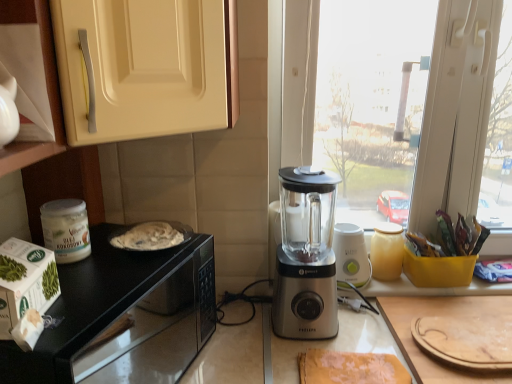
Question: Does satin silver blender at center, acting as the second blender starting from the back, come in front of white cardboard box at left?

Choices:
 (A) no
 (B) yes

Answer: (A)

Question: Does satin silver blender at center, marked as the 1th blender in a left-to-right arrangement, lie behind white cardboard box at left?

Choices:
 (A) no
 (B) yes

Answer: (B)

Question: Does satin silver blender at center, marked as the 1th blender in a left-to-right arrangement, appear on the right side of white cardboard box at left?

Choices:
 (A) no
 (B) yes

Answer: (B)

Question: From a real-world perspective, is satin silver blender at center, marked as the 1th blender in a left-to-right arrangement, positioned over white cardboard box at left based on gravity?

Choices:
 (A) yes
 (B) no

Answer: (B)

Question: Is satin silver blender at center, marked as the 1th blender in a left-to-right arrangement, looking in the opposite direction of white cardboard box at left?

Choices:
 (A) yes
 (B) no

Answer: (B)

Question: Considering the positions of point (403, 367) and point (89, 11), is point (403, 367) closer or farther from the camera than point (89, 11)?

Choices:
 (A) closer
 (B) farther

Answer: (B)

Question: Is yellow fabric at lower center spatially inside matte cream cabinet at upper left, marked as the second cabinetry in a front-to-back arrangement, or outside of it?

Choices:
 (A) outside
 (B) inside

Answer: (A)

Question: From a real-world perspective, relative to matte cream cabinet at upper left, marked as the second cabinetry in a front-to-back arrangement, is yellow fabric at lower center vertically above or below?

Choices:
 (A) above
 (B) below

Answer: (B)

Question: From their relative heights in the image, would you say yellow fabric at lower center is taller or shorter than matte cream cabinet at upper left, marked as the second cabinetry in a front-to-back arrangement?

Choices:
 (A) short
 (B) tall

Answer: (A)

Question: Is yellow fabric at lower center bigger or smaller than satin silver blender at center, which is the 1th blender from front to back?

Choices:
 (A) big
 (B) small

Answer: (B)

Question: In terms of width, does yellow fabric at lower center look wider or thinner when compared to satin silver blender at center, the second blender viewed from the right?

Choices:
 (A) wide
 (B) thin

Answer: (A)

Question: From the image's perspective, is yellow fabric at lower center positioned above or below satin silver blender at center, the second blender viewed from the right?

Choices:
 (A) below
 (B) above

Answer: (A)

Question: Is point (324, 349) positioned closer to the camera than point (321, 296)?

Choices:
 (A) closer
 (B) farther

Answer: (B)

Question: From a real-world perspective, is satin silver blender at center, which is the second blender from left to right, physically located above or below matte cream cabinet at upper left, which is the 1th cabinetry in right-to-left order?

Choices:
 (A) below
 (B) above

Answer: (A)

Question: Considering the relative positions of satin silver blender at center, which is the 1th blender from right to left, and matte cream cabinet at upper left, marked as the second cabinetry in a front-to-back arrangement, in the image provided, is satin silver blender at center, which is the 1th blender from right to left, to the left or to the right of matte cream cabinet at upper left, marked as the second cabinetry in a front-to-back arrangement,?

Choices:
 (A) right
 (B) left

Answer: (A)